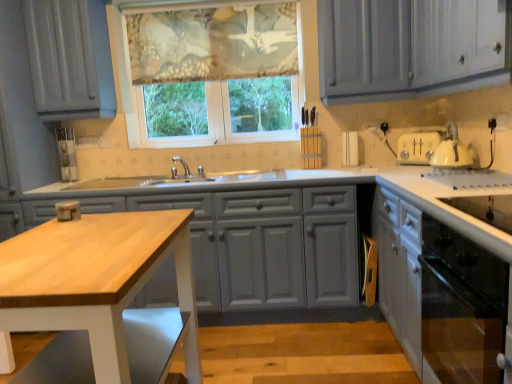
Question: From the image's perspective, relative to wooden table at center, is matte gray cabinets at center, marked as the first cabinetry in a left-to-right arrangement, above or below?

Choices:
 (A) above
 (B) below

Answer: (A)

Question: Is matte gray cabinets at center, the second cabinetry in the right-to-left sequence, inside or outside of wooden table at center?

Choices:
 (A) inside
 (B) outside

Answer: (B)

Question: Which is farther from the matte gray cabinets at center, the second cabinetry in the right-to-left sequence?

Choices:
 (A) textured floral fabric at upper center
 (B) wooden table at center
 (C) white glossy cabinet at lower right, which is the first cabinetry in right-to-left order
 (D) translucent floral fabric at center

Answer: (A)

Question: Estimate the real-world distances between objects in this image. Which object is closer to the translucent floral fabric at center?

Choices:
 (A) white glossy cabinet at lower right, which is the first cabinetry in right-to-left order
 (B) textured floral fabric at upper center
 (C) wooden table at center
 (D) matte gray cabinets at center, marked as the first cabinetry in a left-to-right arrangement

Answer: (B)